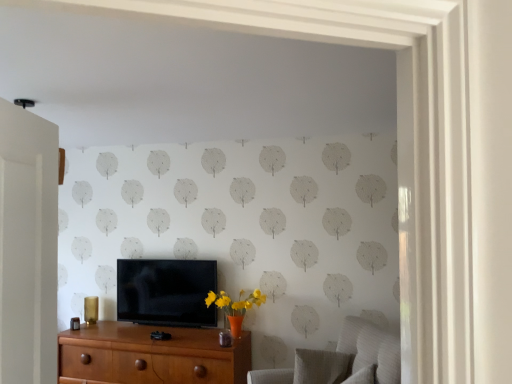
Find the location of `free spot below matte black tv at center (from a real-world perspective)`. free spot below matte black tv at center (from a real-world perspective) is located at coordinates pyautogui.click(x=175, y=322).